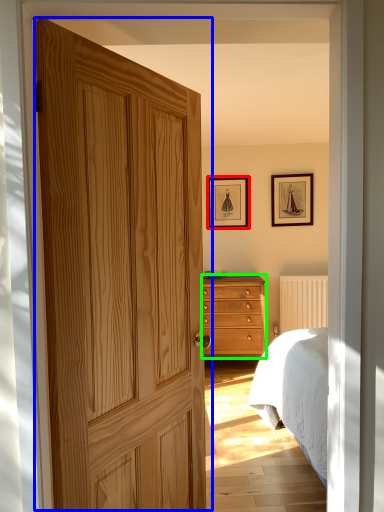
Question: Which object is positioned farthest from picture frame (highlighted by a red box)? Select from door (highlighted by a blue box) and chest of drawers (highlighted by a green box).

Choices:
 (A) door
 (B) chest of drawers

Answer: (A)